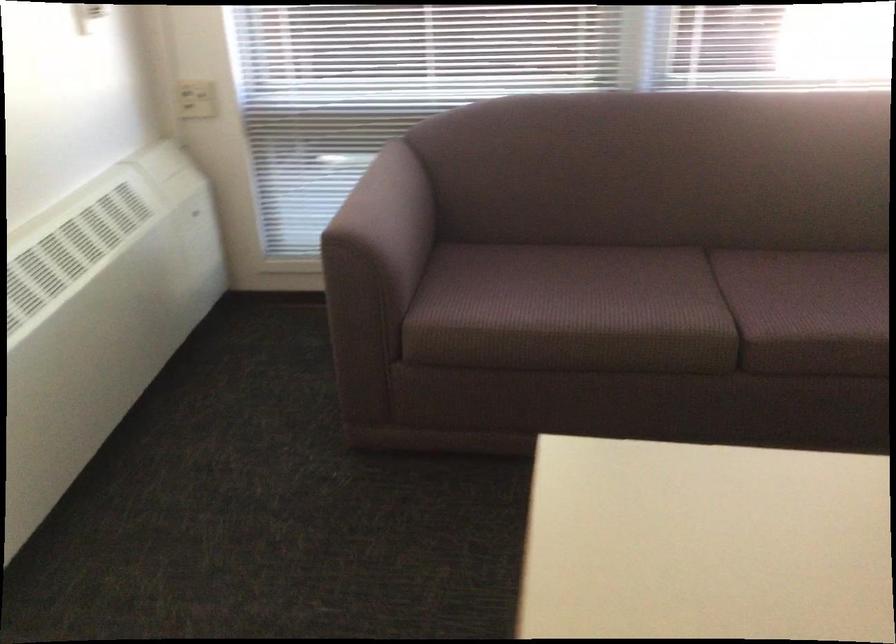
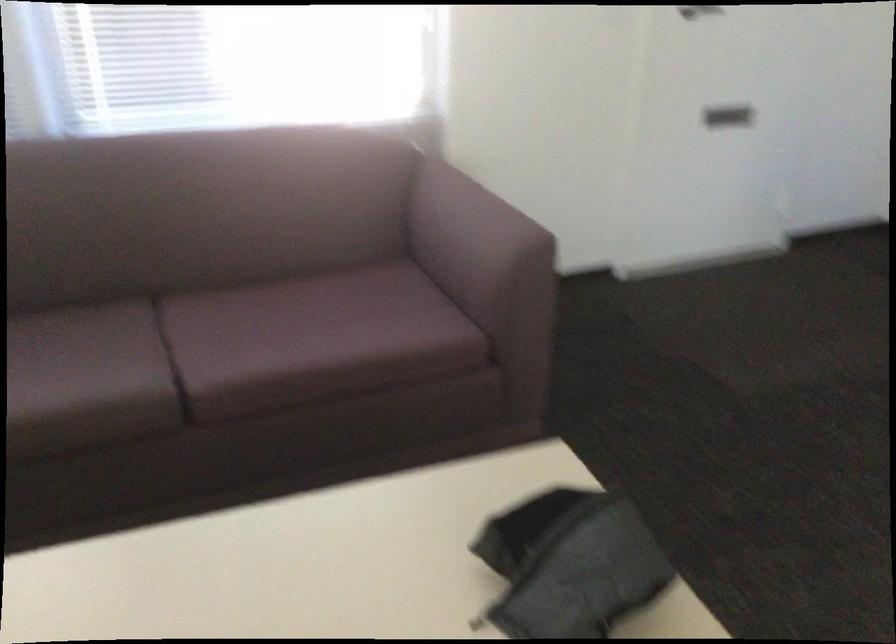
Question: The camera is either moving clockwise (left) or counter-clockwise (right) around the object. The first image is from the beginning of the video and the second image is from the end. Is the camera moving left or right when shooting the video?

Choices:
 (A) Left
 (B) Right

Answer: (A)